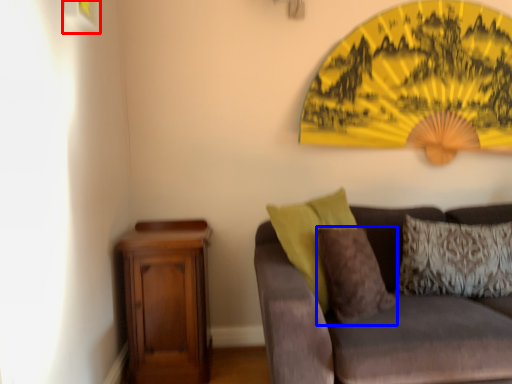
Question: Which point is closer to the camera, picture frame (highlighted by a red box) or pillow (highlighted by a blue box)?

Choices:
 (A) picture frame
 (B) pillow

Answer: (A)